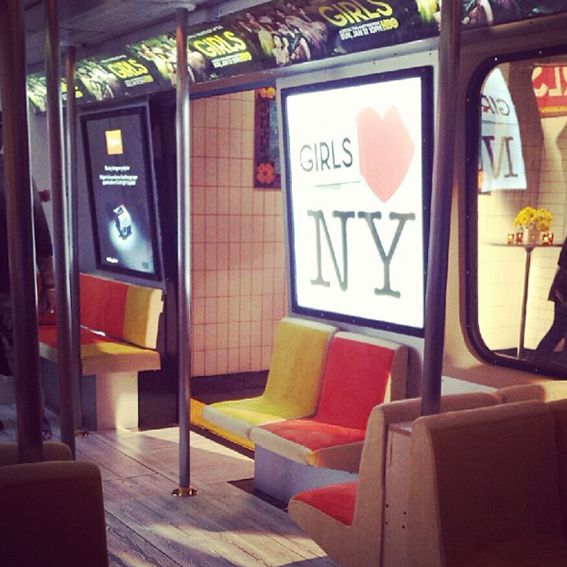
Locate an element on the screen. This screenshot has height=567, width=567. yellow seats is located at coordinates (261, 400), (112, 341).